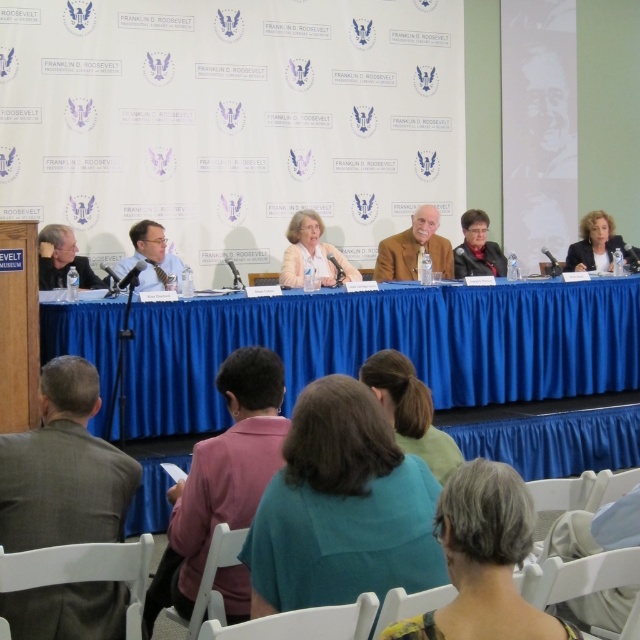
You are standing in the audience looking at the panel discussion setup. There are two points marked in the image, one at coordinate point(51, 262) and another at point(605, 259). Which point is closer to you?

Point(51, 262) is closer to you because it is closer to the camera than point(605, 259).

Consider the image. You are organizing a photo shoot and need to ensure that the two matte black jackets are positioned at least 6 meters apart for proper framing. Based on the scene described, will the current distance between the matte black jacket at left and the matte black jacket at upper right meet your requirement?

The matte black jacket at left and the matte black jacket at upper right are 5.64 meters apart from each other, which is less than the required 6 meters. Therefore, the current distance does not meet the requirement.